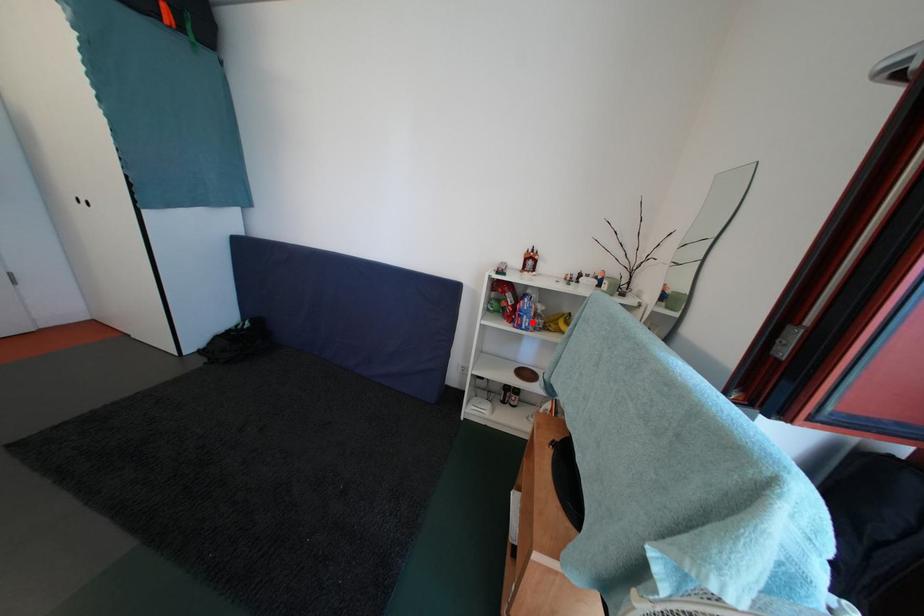
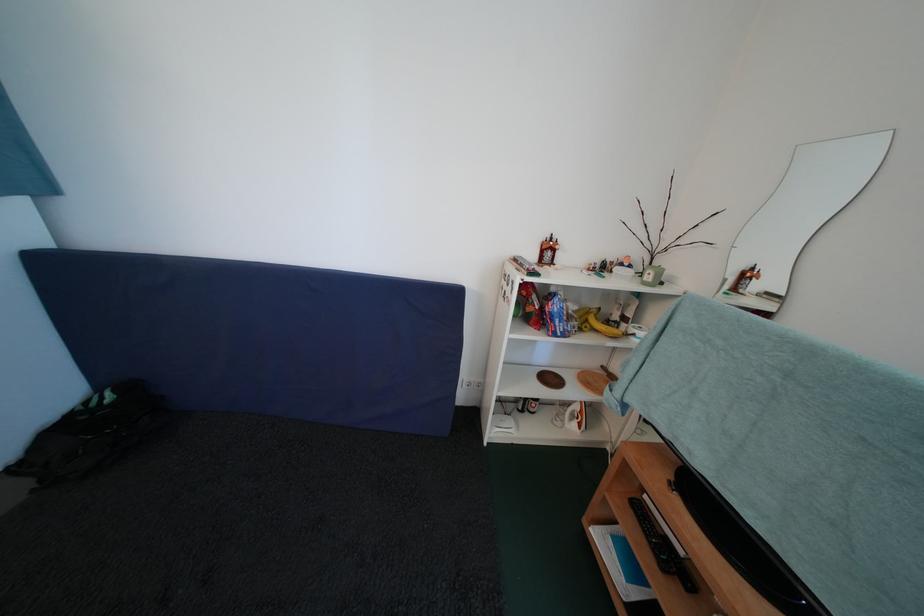
Where in the second image is the point corresponding to the highlighted location from the first image?

(565, 326)